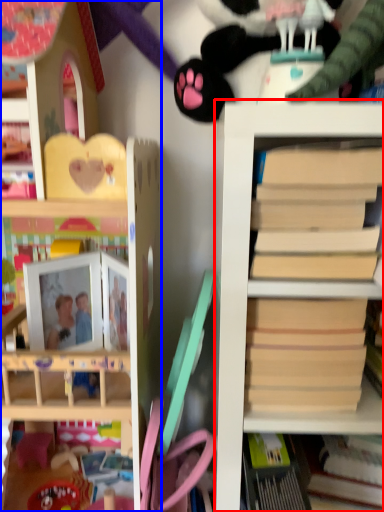
Question: Which object appears farthest to the camera in this image, shelf (highlighted by a red box) or shelf (highlighted by a blue box)?

Choices:
 (A) shelf
 (B) shelf

Answer: (B)